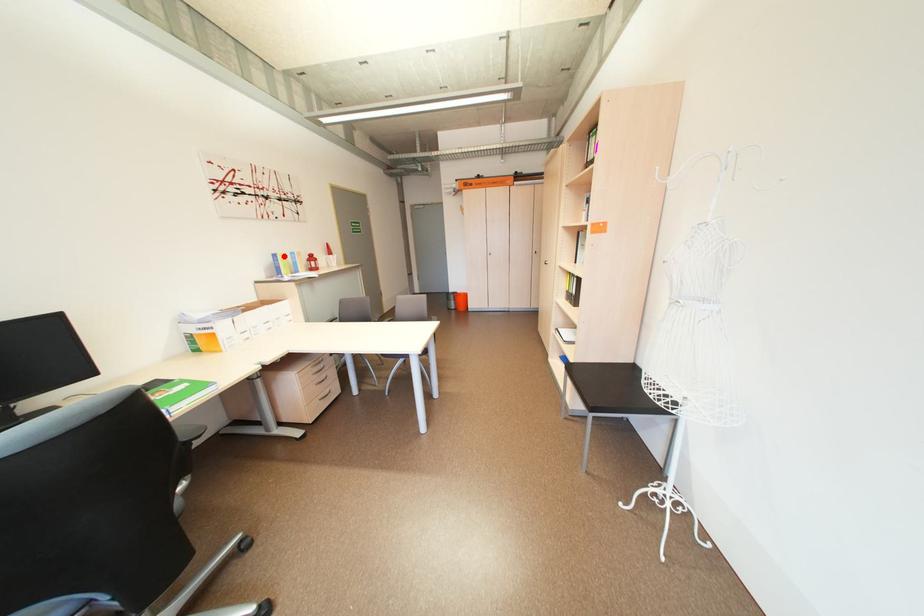
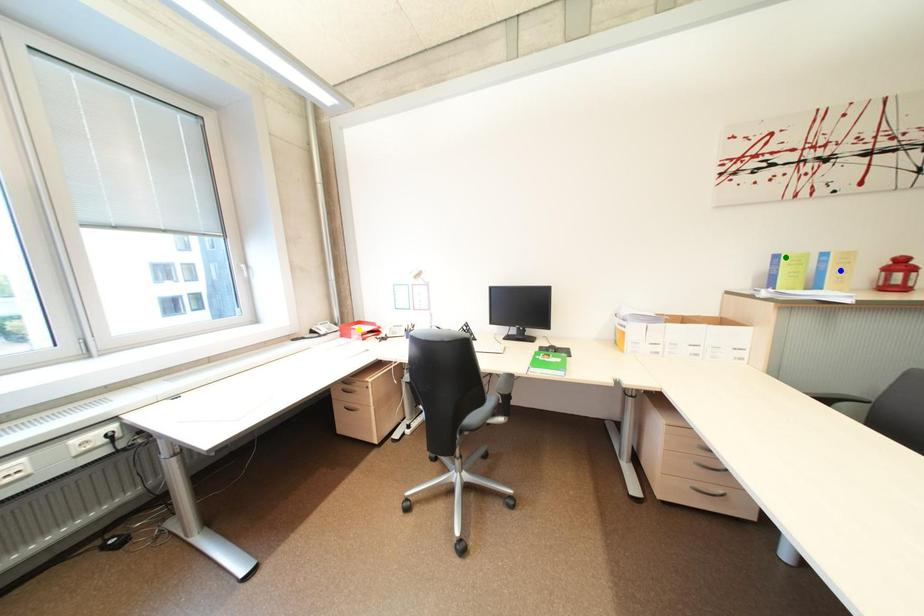
Question: I am providing you with two images of the same scene from different viewpoints. A red point is marked on the first image. You are given multiple points on the second image. Can you choose the point in image 2 that corresponds to the point in image 1?

Choices:
 (A) blue point
 (B) yellow point
 (C) green point

Answer: (C)